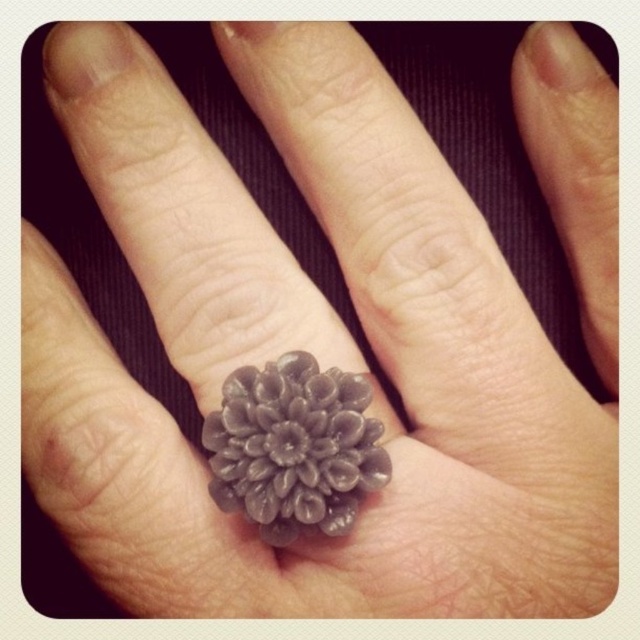
Can you confirm if satin gray ring at center is positioned to the left of matte gray petal at upper right?

Yes, satin gray ring at center is to the left of matte gray petal at upper right.

Looking at this image, is satin gray ring at center wider than matte gray petal at upper right?

Yes, satin gray ring at center is wider than matte gray petal at upper right.

Locate an element on the screen. satin gray ring at center is located at coordinates (294, 448).

Where is `satin gray ring at center`? satin gray ring at center is located at coordinates (294, 448).